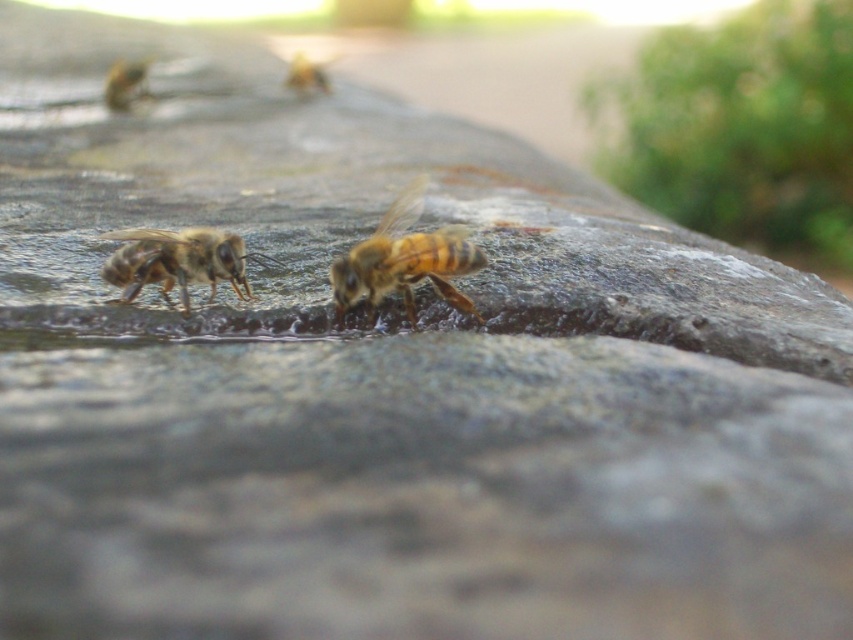
You are a nature photographer trying to capture both the brown fuzzy bee at center and the translucent golden honeybee at upper left in a single shot. Based on their positions, which bee is closer to the camera?

The brown fuzzy bee at center is closer to the camera because it is located below the translucent golden honeybee at upper left, indicating it is positioned in front.